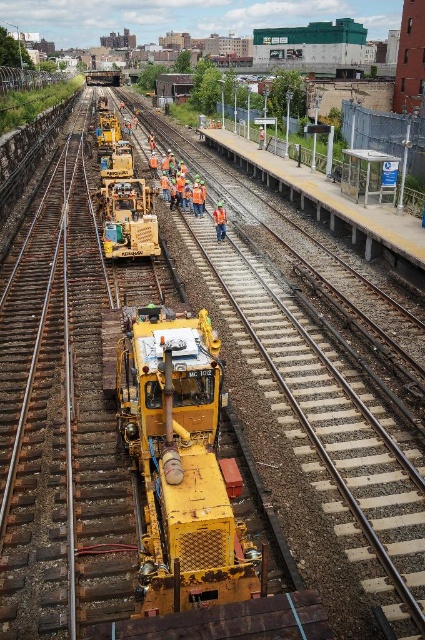
In the scene shown: Does yellow rubber construction vehicle at center have a larger size compared to orange reflective safety vest at center?

Yes, yellow rubber construction vehicle at center is bigger than orange reflective safety vest at center.

Can you confirm if yellow rubber construction vehicle at center is positioned above orange reflective safety vest at center?

Correct, yellow rubber construction vehicle at center is located above orange reflective safety vest at center.

Locate an element on the screen. Image resolution: width=425 pixels, height=640 pixels. yellow rubber construction vehicle at center is located at coordinates (125, 208).

Locate an element on the screen. yellow rubber construction vehicle at center is located at coordinates (125, 208).

Which of these two, matte yellow construction vehicle at center or yellow rubber construction vehicle at center, stands taller?

Standing taller between the two is yellow rubber construction vehicle at center.

Consider the image. Who is positioned more to the left, matte yellow construction vehicle at center or yellow rubber construction vehicle at center?

Positioned to the left is yellow rubber construction vehicle at center.

Who is more forward, [204,484] or [122,157]?

Point [204,484] is more forward.

At what (x,y) coordinates should I click in order to perform the action: click on matte yellow construction vehicle at center. Please return your answer as a coordinate pair (x, y). This screenshot has height=640, width=425. Looking at the image, I should click on click(x=181, y=465).

Is point (164, 449) closer to viewer compared to point (226, 218)?

That is True.

Which is behind, point (210, 456) or point (221, 216)?

Positioned behind is point (221, 216).

The image size is (425, 640). What do you see at coordinates (181, 465) in the screenshot?
I see `matte yellow construction vehicle at center` at bounding box center [181, 465].

I want to click on matte yellow construction vehicle at center, so click(x=181, y=465).